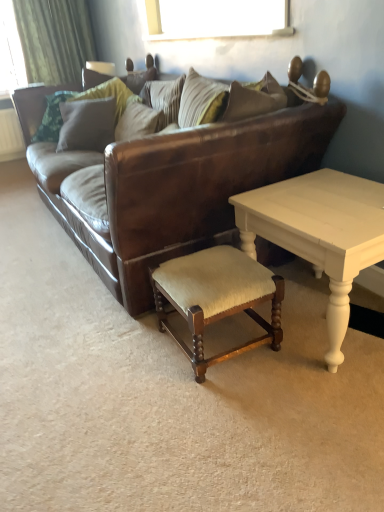
Locate an element on the screen. striped fabric pillow at center, the 2th pillow positioned from the left is located at coordinates click(164, 99).

What do you see at coordinates (320, 233) in the screenshot?
I see `white painted wood coffee table at right` at bounding box center [320, 233].

I want to click on white painted wood coffee table at right, so click(320, 233).

The image size is (384, 512). What do you see at coordinates (54, 39) in the screenshot?
I see `green fabric curtain at upper left` at bounding box center [54, 39].

I want to click on striped fabric pillow at center, positioned as the 1th pillow in right-to-left order, so click(164, 99).

Locate an element on the screen. studio couch above the wooden upholstered stool at lower center (from a real-world perspective) is located at coordinates (168, 179).

Is brown leather couch at center at the back of wooden upholstered stool at lower center?

wooden upholstered stool at lower center does not have its back to brown leather couch at center.

Considering the relative positions of wooden upholstered stool at lower center and brown leather couch at center in the image provided, is wooden upholstered stool at lower center to the left of brown leather couch at center from the viewer's perspective?

No.

Which point is more distant from viewer, (180, 266) or (244, 128)?

Positioned behind is point (180, 266).

Does green fabric curtain at upper left have a lesser height compared to brown leather couch at center?

Yes.

From a real-world perspective, is green fabric curtain at upper left beneath brown leather couch at center?

Incorrect, from a real-world perspective, green fabric curtain at upper left is higher than brown leather couch at center.

Is green fabric curtain at upper left far away from brown leather couch at center?

green fabric curtain at upper left is far away from brown leather couch at center.

Between striped fabric pillow at center, the 2th pillow positioned from the left, and green fabric curtain at upper left, which one has larger width?

Wider between the two is green fabric curtain at upper left.

Which pillow is the 2nd one when counting from the right side of the green fabric curtain at upper left? Please provide its 2D coordinates.

[(164, 99)]

Which is closer to the camera, (166, 85) or (62, 17)?

Positioned in front is point (166, 85).

Does striped fabric pillow at center, positioned as the 1th pillow in right-to-left order, have a smaller size compared to green fabric curtain at upper left?

Yes, striped fabric pillow at center, positioned as the 1th pillow in right-to-left order, is smaller than green fabric curtain at upper left.

Is wooden upholstered stool at lower center taller than white painted wood coffee table at right?

No.

Does point (228, 313) come behind point (312, 232)?

Yes, it is behind point (312, 232).

Considering the relative sizes of wooden upholstered stool at lower center and white painted wood coffee table at right in the image provided, is wooden upholstered stool at lower center wider than white painted wood coffee table at right?

No, wooden upholstered stool at lower center is not wider than white painted wood coffee table at right.

Is point (200, 137) positioned after point (62, 60)?

No, (200, 137) is closer to viewer.

Looking at this image, what's the angular difference between brown leather couch at center and green fabric curtain at upper left's facing directions?

The angle between the facing direction of brown leather couch at center and the facing direction of green fabric curtain at upper left is 90 degrees.

From the image's perspective, is brown leather couch at center located beneath green fabric curtain at upper left?

Yes, from the image's perspective, brown leather couch at center is below green fabric curtain at upper left.

Considering the positions of objects velvet green pillow at upper center, acting as the 2th pillow starting from the right, and brown leather couch at center in the image provided, who is more to the right, velvet green pillow at upper center, acting as the 2th pillow starting from the right, or brown leather couch at center?

Positioned to the right is brown leather couch at center.

Between velvet green pillow at upper center, acting as the 2th pillow starting from the right, and brown leather couch at center, which one has more height?

Standing taller between the two is brown leather couch at center.

Choose the correct answer: Is velvet green pillow at upper center, acting as the 2th pillow starting from the right, inside brown leather couch at center or outside it?

velvet green pillow at upper center, acting as the 2th pillow starting from the right, exists entirely within brown leather couch at center.

From the picture: Considering the positions of objects green fabric curtain at upper left and velvet green pillow at upper center, acting as the 2th pillow starting from the right, in the image provided, who is behind, green fabric curtain at upper left or velvet green pillow at upper center, acting as the 2th pillow starting from the right,?

Positioned behind is green fabric curtain at upper left.

Looking at the image, does green fabric curtain at upper left seem bigger or smaller compared to velvet green pillow at upper center, which ranks as the 1th pillow in left-to-right order?

Considering their sizes, green fabric curtain at upper left takes up more space than velvet green pillow at upper center, which ranks as the 1th pillow in left-to-right order.

Is green fabric curtain at upper left next to velvet green pillow at upper center, acting as the 2th pillow starting from the right, and touching it?

green fabric curtain at upper left and velvet green pillow at upper center, acting as the 2th pillow starting from the right, are not in contact.

Image resolution: width=384 pixels, height=512 pixels. I want to click on table below the brown leather couch at center (from a real-world perspective), so click(x=217, y=298).

Where is `curtain above the brown leather couch at center (from a real-world perspective)`? curtain above the brown leather couch at center (from a real-world perspective) is located at coordinates (54, 39).

Based on their spatial positions, is white painted wood coffee table at right or green fabric curtain at upper left closer to striped fabric pillow at center, positioned as the 1th pillow in right-to-left order?

white painted wood coffee table at right lies closer to striped fabric pillow at center, positioned as the 1th pillow in right-to-left order, than the other object.

Looking at the image, which one is located further to velvet green pillow at upper center, acting as the 2th pillow starting from the right, striped fabric pillow at center, the 2th pillow positioned from the left, or white painted wood coffee table at right?

white painted wood coffee table at right is positioned further to the anchor velvet green pillow at upper center, acting as the 2th pillow starting from the right.

Which object lies further to the anchor point white painted wood coffee table at right, striped fabric pillow at center, positioned as the 1th pillow in right-to-left order, or wooden upholstered stool at lower center?

striped fabric pillow at center, positioned as the 1th pillow in right-to-left order, lies further to white painted wood coffee table at right than the other object.

Looking at this image, considering their positions, is brown leather couch at center positioned further to striped fabric pillow at center, the 2th pillow positioned from the left, than velvet green pillow at upper center, acting as the 2th pillow starting from the right?

brown leather couch at center is further to striped fabric pillow at center, the 2th pillow positioned from the left.

Which object lies further to the anchor point brown leather couch at center, striped fabric pillow at center, the 2th pillow positioned from the left, or velvet green pillow at upper center, which ranks as the 1th pillow in left-to-right order?

Among the two, velvet green pillow at upper center, which ranks as the 1th pillow in left-to-right order, is located further to brown leather couch at center.

From the image, which object appears to be nearer to wooden upholstered stool at lower center, green fabric curtain at upper left or brown leather couch at center?

brown leather couch at center is positioned closer to the anchor wooden upholstered stool at lower center.

Considering their positions, is velvet green pillow at upper center, which ranks as the 1th pillow in left-to-right order, positioned further to striped fabric pillow at center, positioned as the 1th pillow in right-to-left order, than white painted wood coffee table at right?

The object further to striped fabric pillow at center, positioned as the 1th pillow in right-to-left order, is white painted wood coffee table at right.

From the image, which object appears to be farther from striped fabric pillow at center, positioned as the 1th pillow in right-to-left order, wooden upholstered stool at lower center or white painted wood coffee table at right?

wooden upholstered stool at lower center lies further to striped fabric pillow at center, positioned as the 1th pillow in right-to-left order, than the other object.

This screenshot has width=384, height=512. What are the coordinates of `pillow between wooden upholstered stool at lower center and velvet green pillow at upper center, acting as the 2th pillow starting from the right, from front to back` in the screenshot? It's located at (164, 99).

Where is `table positioned between white painted wood coffee table at right and velvet green pillow at upper center, acting as the 2th pillow starting from the right, from near to far`? table positioned between white painted wood coffee table at right and velvet green pillow at upper center, acting as the 2th pillow starting from the right, from near to far is located at coordinates (217, 298).

Where is `studio couch between white painted wood coffee table at right and striped fabric pillow at center, the 2th pillow positioned from the left, in the front-back direction`? studio couch between white painted wood coffee table at right and striped fabric pillow at center, the 2th pillow positioned from the left, in the front-back direction is located at coordinates (168, 179).

Image resolution: width=384 pixels, height=512 pixels. I want to click on coffee table between brown leather couch at center and wooden upholstered stool at lower center vertically, so click(x=320, y=233).